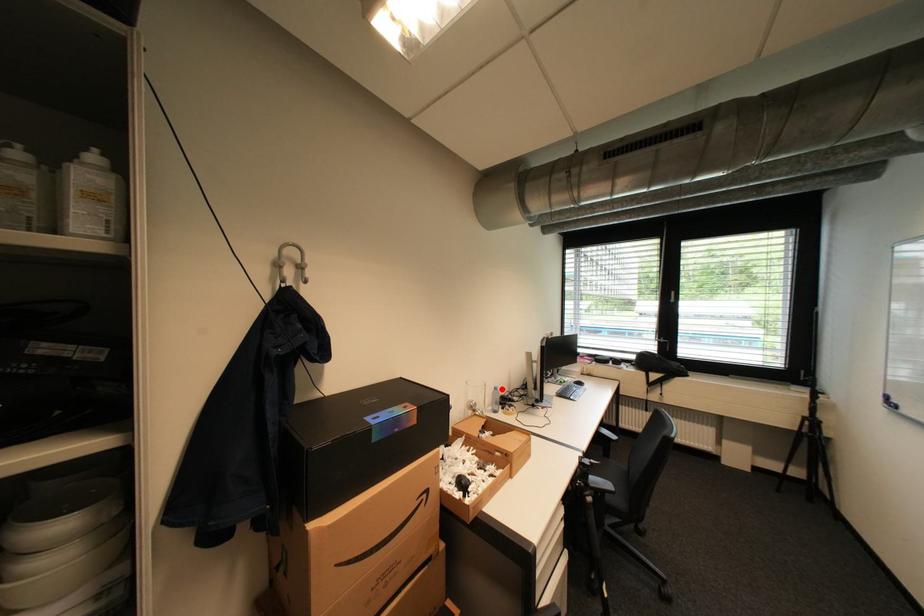
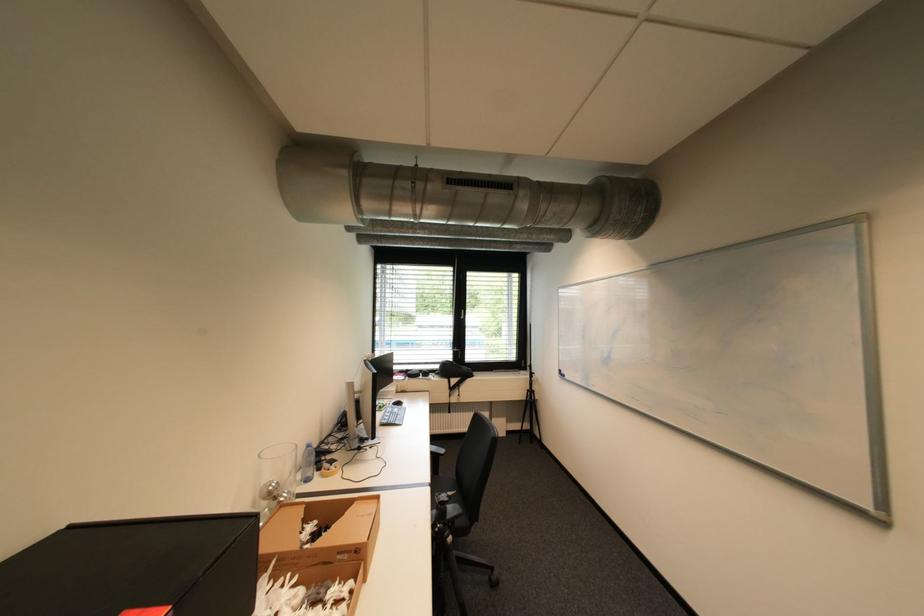
Find the pixel in the second image that matches the highlighted location in the first image.

(313, 448)